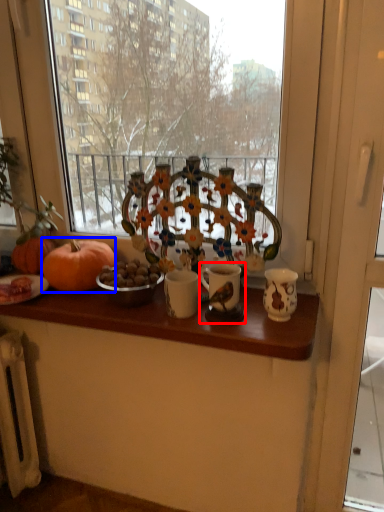
Question: Which point is closer to the camera, candle holder (highlighted by a red box) or pumpkin (highlighted by a blue box)?

Choices:
 (A) candle holder
 (B) pumpkin

Answer: (A)